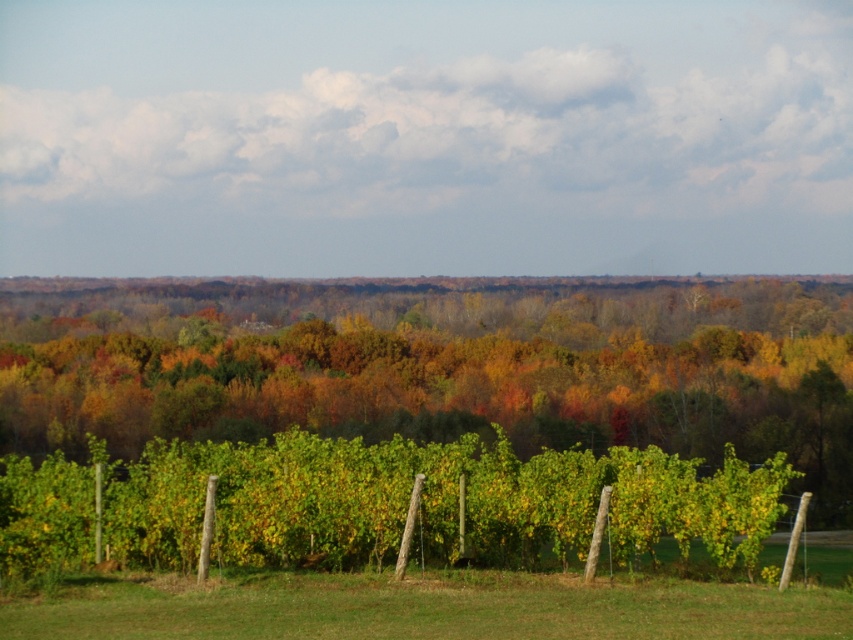
You are standing in the vineyard looking towards the forest. You see the green leafy vines at center and the green grass at lower center. Which one is closer to your right side?

The green grass at lower center is closer to your right side because the green leafy vines at center are positioned to the left of it.

You are a gardener who wants to plant new flowers in the area between the green leafy vines at center and the green grass at lower center. Which area has more space for planting?

The green leafy vines at center is bigger than green grass at lower center, so there is more space for planting between the green leafy vines at center and the green grass at lower center.